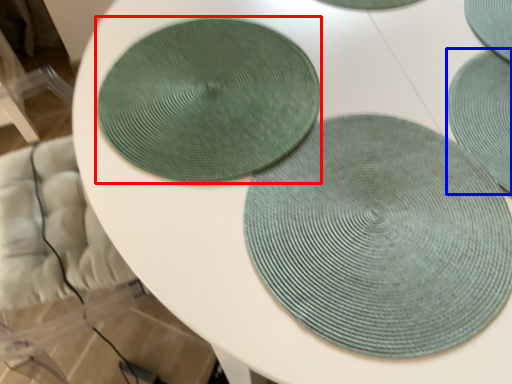
Question: Which of the following is the closest to the observer, coaster (highlighted by a red box) or mat (highlighted by a blue box)?

Choices:
 (A) coaster
 (B) mat

Answer: (B)